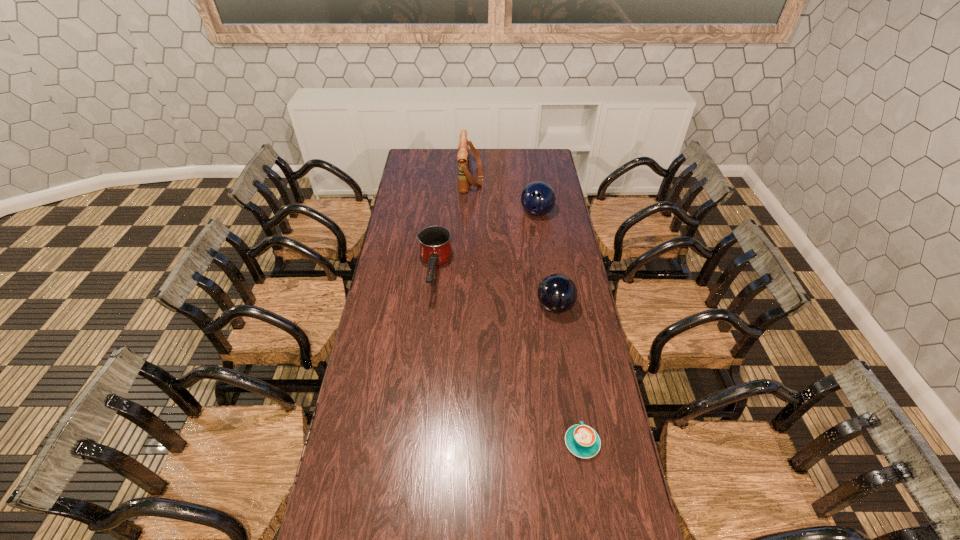
Locate an element on the screen. The width and height of the screenshot is (960, 540). object that stands as the third closest to the second farthest object is located at coordinates (557, 293).

Where is `free point that satisfies the following two spatial constraints: 1. with the handle on the right side of the shortest object; 2. on the front-facing side of the tallest object`? free point that satisfies the following two spatial constraints: 1. with the handle on the right side of the shortest object; 2. on the front-facing side of the tallest object is located at coordinates (538, 178).

Where is `free region that satisfies the following two spatial constraints: 1. with the handle on the right side of the nearest object; 2. on the side of the nearer bowling ball with the finger holes`? The width and height of the screenshot is (960, 540). free region that satisfies the following two spatial constraints: 1. with the handle on the right side of the nearest object; 2. on the side of the nearer bowling ball with the finger holes is located at coordinates (559, 306).

Image resolution: width=960 pixels, height=540 pixels. Find the location of `free space that satisfies the following two spatial constraints: 1. on the side of the nearer bowling ball with the finger holes; 2. with the handle on the right side of the nearest object`. free space that satisfies the following two spatial constraints: 1. on the side of the nearer bowling ball with the finger holes; 2. with the handle on the right side of the nearest object is located at coordinates (577, 443).

Image resolution: width=960 pixels, height=540 pixels. I want to click on vacant space that satisfies the following two spatial constraints: 1. on the side of the nearer bowling ball with the finger holes; 2. with the handle on the right side of the cappuccino, so click(x=577, y=443).

Locate an element on the screen. vacant space that satisfies the following two spatial constraints: 1. on the side of the nearer bowling ball with the finger holes; 2. with the handle on the right side of the shortest object is located at coordinates (577, 443).